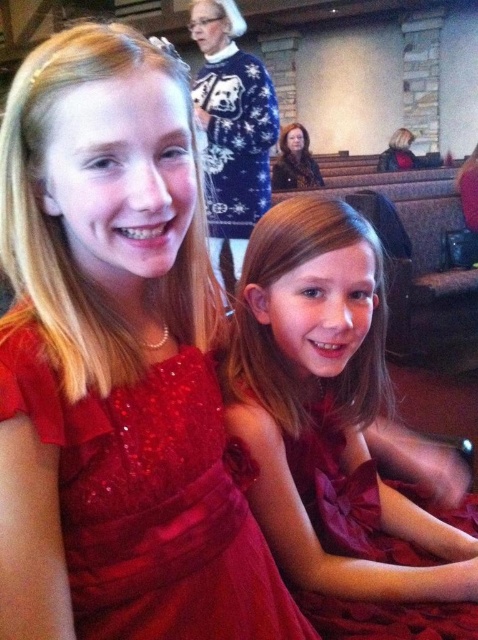
Question: Does satin red dress at center appear under blue fuzzy sweater at upper center?

Choices:
 (A) yes
 (B) no

Answer: (A)

Question: Based on their relative distances, which object is nearer to the shiny red dress at center?

Choices:
 (A) blue fuzzy sweater at upper center
 (B) satin red dress at center

Answer: (B)

Question: Does shiny red dress at center have a larger size compared to blue fuzzy sweater at upper center?

Choices:
 (A) no
 (B) yes

Answer: (A)

Question: Which point is farther to the camera?

Choices:
 (A) satin red dress at center
 (B) blue fuzzy sweater at upper center
 (C) shiny red dress at center

Answer: (B)

Question: Can you confirm if satin red dress at center is positioned to the right of blue fuzzy sweater at upper center?

Choices:
 (A) no
 (B) yes

Answer: (B)

Question: Which point is closer to the camera?

Choices:
 (A) (237, 88)
 (B) (324, 472)
 (C) (178, 424)

Answer: (C)